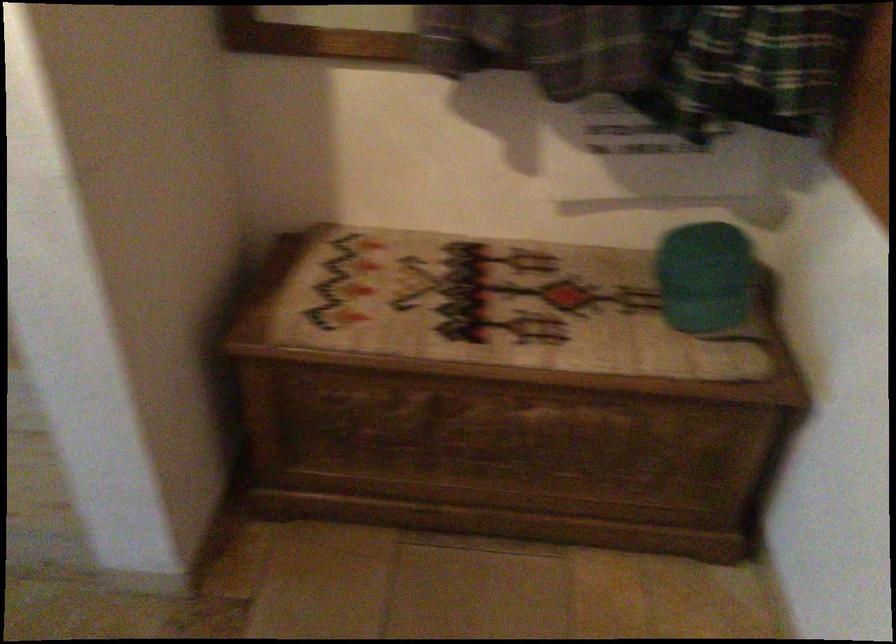
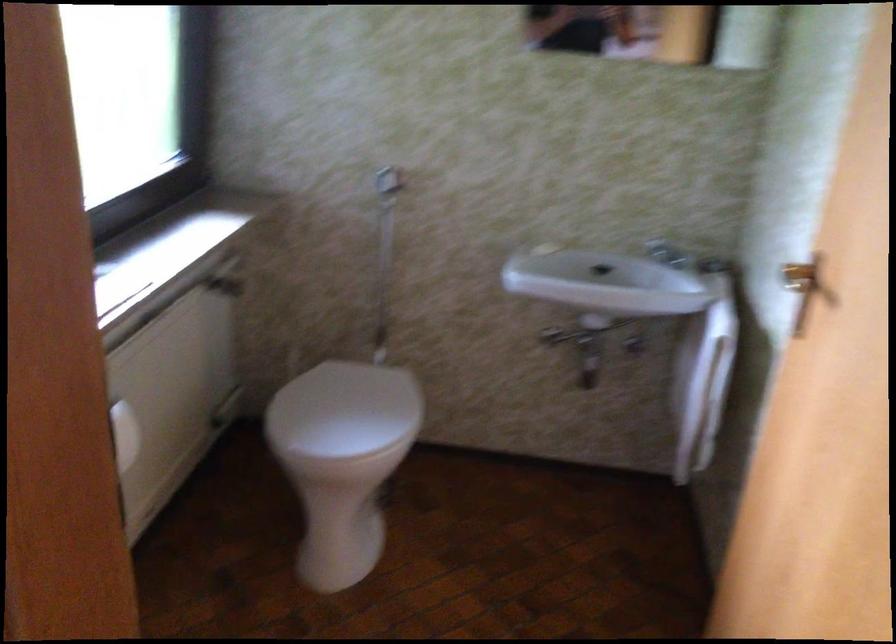
Question: The images are taken continuously from a first-person perspective. In which direction are you moving?

Choices:
 (A) Left
 (B) Right
 (C) Forward
 (D) Backward

Answer: (A)